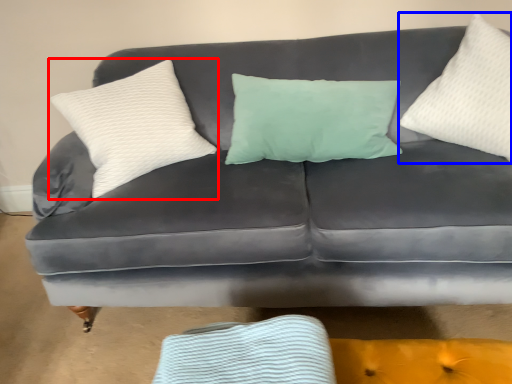
Question: Which of the following is the farthest to the observer, pillow (highlighted by a red box) or pillow (highlighted by a blue box)?

Choices:
 (A) pillow
 (B) pillow

Answer: (A)